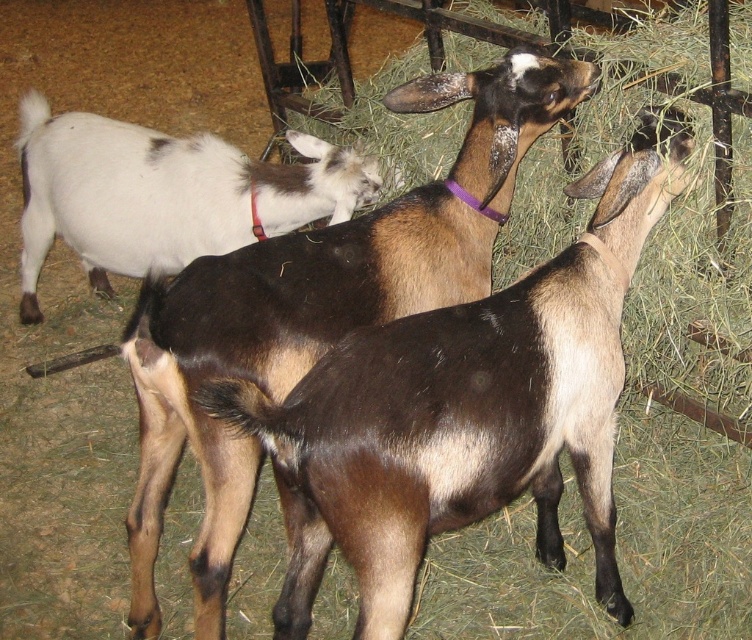
You are a farmer checking the health of your goats. You notice that the brown fuzzy goat at center has a purple collar and is eating hay. How does its height compare to the white matte goat at upper left?

The brown fuzzy goat at center is taller than the white matte goat at upper left according to the description.

You are a farmer who needs to separate two goats using a divider that is 4 feet wide. You see the brown fuzzy goat at center and the white matte goat at upper left. Can you fit the divider between them without pushing either goat?

The distance between the brown fuzzy goat at center and the white matte goat at upper left is 4.71 feet. Since the divider is 4 feet wide, there is enough space to place it between them without needing to move the goats.

Looking at the barn scene with the brown fuzzy goat at center and the white matte goat at upper left, which goat is positioned more to the right side of the image?

The brown fuzzy goat at center is positioned to the right of the white matte goat at upper left, so it is more to the right side of the image.